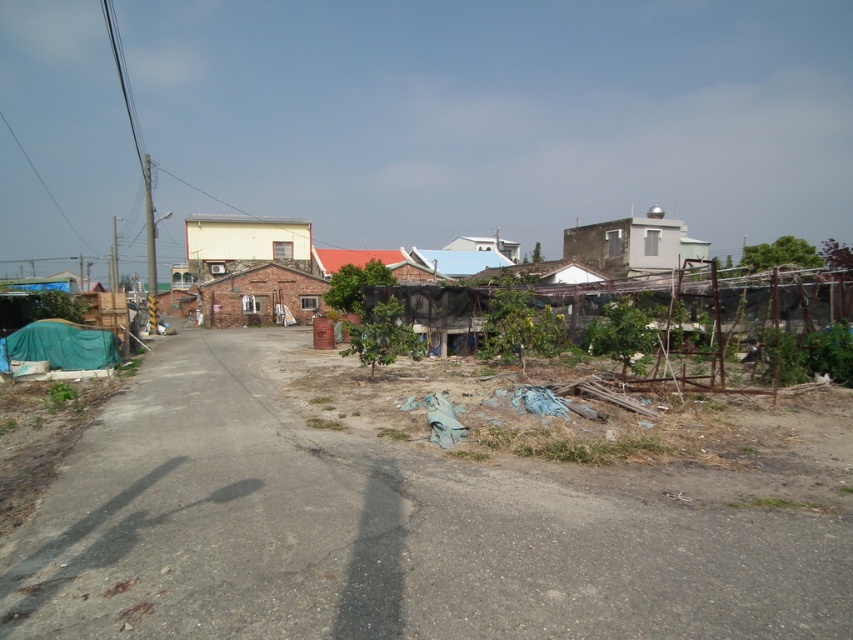
You are standing at the edge of the dirt road at center and want to walk towards the brick house at center. Which direction should you go?

Since the dirt road at center is closer to the viewer than the brick house at center, you should walk forward along the dirt road at center towards the brick house at center.

From the picture: You are a delivery driver who needs to park your truck near the white matte building at center and the white smooth building at upper right. Since the parking space is limited, which building would you choose to park closer to if you want to ensure you can fit your truck without blocking the road?

The white smooth building at upper right is smaller than the white matte building at center, so parking closer to the white smooth building at upper right would require less space, allowing the truck to fit without blocking the road.

You are standing at the starting point of the road in the image. There are two points marked on the road. One is at point [216,224] and the other is at point [659,205]. Which point is closer to you as you face the direction the road is going?

Point [216,224] is closer to you because it is in front of point [659,205] along the road.